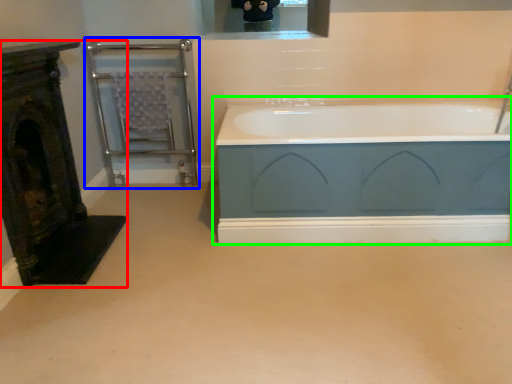
Question: Estimate the real-world distances between objects in this image. Which object is farther from fireplace (highlighted by a red box), balustrade (highlighted by a blue box) or bathtub (highlighted by a green box)?

Choices:
 (A) balustrade
 (B) bathtub

Answer: (B)